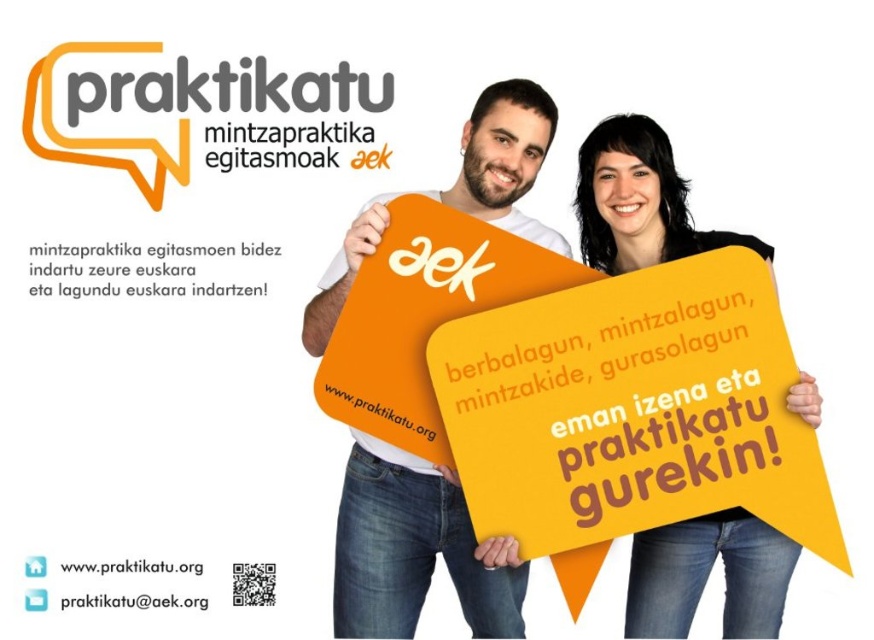
You are looking at the promotional advertisement for praktikatu. The orange paper sign at center and the white paper at center are both present. Which one is shorter?

The orange paper sign at center is not as tall as the white paper at center, so the orange paper sign at center is shorter.

In the scene shown: You are a graphic designer tasked with aligning elements for a new advertisement. You need to place a new element between the orange matte sign at center and the white paper at center. Given the distance between them is 18.45 inches, what is the minimum width your new element should be to fit snugly between them without overlapping?

The minimum width your new element should be is 18.45 inches to fit snugly between the orange matte sign at center and the white paper at center without overlapping.